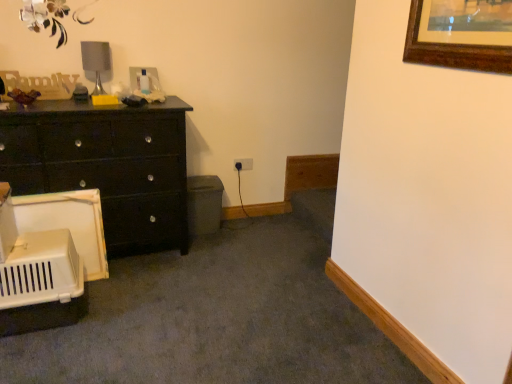
Image resolution: width=512 pixels, height=384 pixels. What do you see at coordinates (106, 165) in the screenshot?
I see `matte black dresser at left` at bounding box center [106, 165].

Locate an element on the screen. The image size is (512, 384). matte black dresser at left is located at coordinates (106, 165).

Looking at this image, what is the approximate height of matte black dresser at left?

matte black dresser at left is 37.34 inches tall.

What is the approximate width of matte black dresser at left?

matte black dresser at left is 19.75 inches wide.

From the picture: What is the approximate height of matte silver table lamp at upper left?

It is 13.08 inches.

Where is `matte silver table lamp at upper left`? matte silver table lamp at upper left is located at coordinates (96, 61).

This screenshot has width=512, height=384. What do you see at coordinates (96, 61) in the screenshot? I see `matte silver table lamp at upper left` at bounding box center [96, 61].

Identify the location of matte black dresser at left. (106, 165).

Visually, is matte black dresser at left positioned to the left or to the right of matte silver table lamp at upper left?

In the image, matte black dresser at left appears on the left side of matte silver table lamp at upper left.

Does matte black dresser at left come in front of matte silver table lamp at upper left?

Yes.

Considering the positions of points (5, 162) and (94, 45), is point (5, 162) closer to camera compared to point (94, 45)?

Yes, it is.

From the image's perspective, which is below, matte black dresser at left or matte silver table lamp at upper left?

From the image's view, matte black dresser at left is below.

From a real-world perspective, is matte black dresser at left physically above matte silver table lamp at upper left?

Actually, matte black dresser at left is physically below matte silver table lamp at upper left in the real world.

Is matte black dresser at left wider or thinner than matte silver table lamp at upper left?

Clearly, matte black dresser at left has more width compared to matte silver table lamp at upper left.

From their relative heights in the image, would you say matte black dresser at left is taller or shorter than matte silver table lamp at upper left?

In the image, matte black dresser at left appears to be taller than matte silver table lamp at upper left.

Is matte black dresser at left bigger or smaller than matte silver table lamp at upper left?

Clearly, matte black dresser at left is larger in size than matte silver table lamp at upper left.

Can we say matte black dresser at left lies outside matte silver table lamp at upper left?

That's correct, matte black dresser at left is outside of matte silver table lamp at upper left.

Is matte black dresser at left far away from matte silver table lamp at upper left?

No, matte black dresser at left is not far away from matte silver table lamp at upper left.

Is matte black dresser at left oriented away from matte silver table lamp at upper left?

No, matte black dresser at left's orientation is not away from matte silver table lamp at upper left.

How distant is matte black dresser at left from matte silver table lamp at upper left?

They are 23.36 inches apart.

Image resolution: width=512 pixels, height=384 pixels. I want to click on the chest of drawers that is below the matte silver table lamp at upper left (from the image's perspective), so click(106, 165).

Considering the positions of objects matte silver table lamp at upper left and matte black dresser at left in the image provided, who is more to the left, matte silver table lamp at upper left or matte black dresser at left?

matte black dresser at left.

Is matte silver table lamp at upper left behind matte black dresser at left?

Yes.

Which point is more distant from viewer, (92,44) or (172,112)?

Positioned behind is point (92,44).

From the image's perspective, which one is positioned higher, matte silver table lamp at upper left or matte black dresser at left?

From the image's view, matte silver table lamp at upper left is above.

From a real-world perspective, is matte silver table lamp at upper left physically located above or below matte black dresser at left?

matte silver table lamp at upper left is above matte black dresser at left.

Considering the relative sizes of matte silver table lamp at upper left and matte black dresser at left in the image provided, is matte silver table lamp at upper left thinner than matte black dresser at left?

Yes.

Considering the relative sizes of matte silver table lamp at upper left and matte black dresser at left in the image provided, is matte silver table lamp at upper left shorter than matte black dresser at left?

Indeed, matte silver table lamp at upper left has a lesser height compared to matte black dresser at left.

Does matte silver table lamp at upper left have a smaller size compared to matte black dresser at left?

Yes.

Looking at this image, would you say matte silver table lamp at upper left contains matte black dresser at left?

Actually, matte black dresser at left is outside matte silver table lamp at upper left.

Is matte silver table lamp at upper left next to matte black dresser at left?

No, matte silver table lamp at upper left is not making contact with matte black dresser at left.

Is matte silver table lamp at upper left aimed at matte black dresser at left?

No.

Locate an element on the screen. Image resolution: width=512 pixels, height=384 pixels. table lamp behind the matte black dresser at left is located at coordinates (96, 61).

At what (x,y) coordinates should I click in order to perform the action: click on chest of drawers to the left of matte silver table lamp at upper left. Please return your answer as a coordinate pair (x, y). This screenshot has height=384, width=512. Looking at the image, I should click on (106, 165).

You are a GUI agent. You are given a task and a screenshot of the screen. Output one action in this format:
    pyautogui.click(x=<x>, y=<y>)
    Task: Click on the chest of drawers that appears below the matte silver table lamp at upper left (from the image's perspective)
    The width and height of the screenshot is (512, 384).
    Given the screenshot: What is the action you would take?
    pyautogui.click(x=106, y=165)